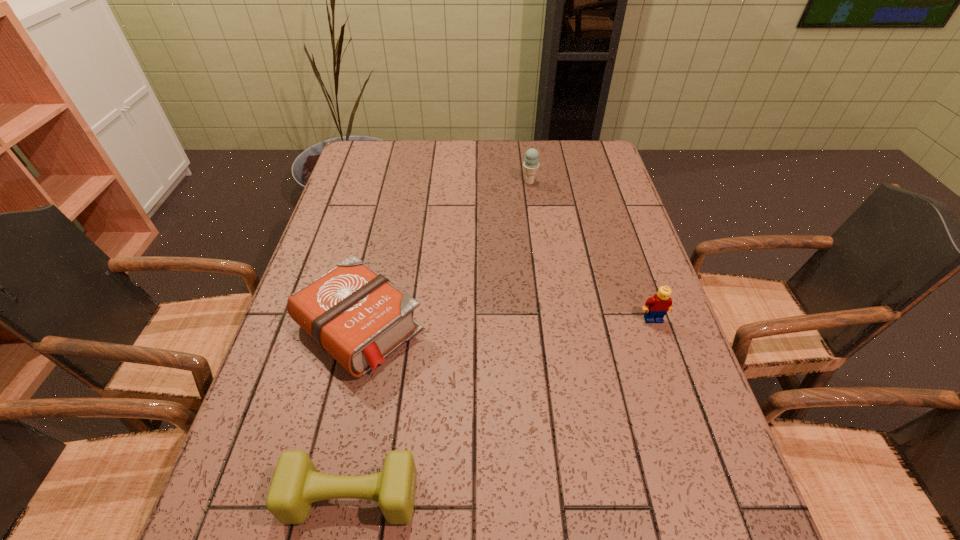
Locate an element on the screen. dumbbell that is at the left edge is located at coordinates (296, 484).

In order to click on object situated at the right edge in this screenshot , I will do `click(660, 303)`.

Where is `vacant space at the far edge of the desktop`? This screenshot has width=960, height=540. vacant space at the far edge of the desktop is located at coordinates (402, 141).

In the image, there is a desktop. Where is `vacant space at the near edge`? The image size is (960, 540). vacant space at the near edge is located at coordinates (566, 529).

Locate an element on the screen. The image size is (960, 540). vacant area at the left edge is located at coordinates (261, 392).

Locate an element on the screen. The height and width of the screenshot is (540, 960). vacant space at the right edge is located at coordinates (659, 326).

The image size is (960, 540). Identify the location of empty space that is in between the Bible and the ice cream. (444, 255).

This screenshot has width=960, height=540. I want to click on unoccupied position between the Bible and the Lego, so click(506, 323).

The width and height of the screenshot is (960, 540). I want to click on vacant region between the Bible and the second object from right to left, so click(x=444, y=255).

I want to click on free space between the nearest object and the third object from left to right, so click(441, 340).